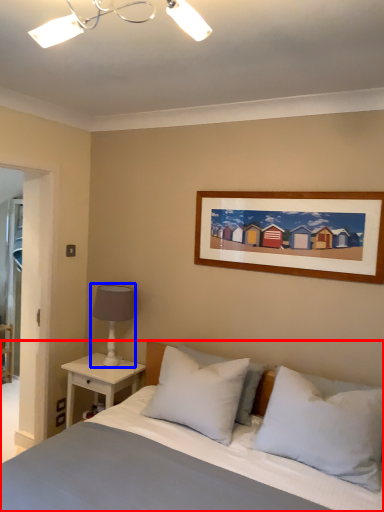
Question: Which object appears farthest to the camera in this image, bed (highlighted by a red box) or table lamp (highlighted by a blue box)?

Choices:
 (A) bed
 (B) table lamp

Answer: (B)